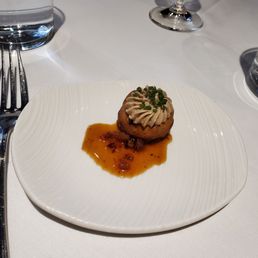
The height and width of the screenshot is (258, 258). I want to click on plate, so click(68, 111).